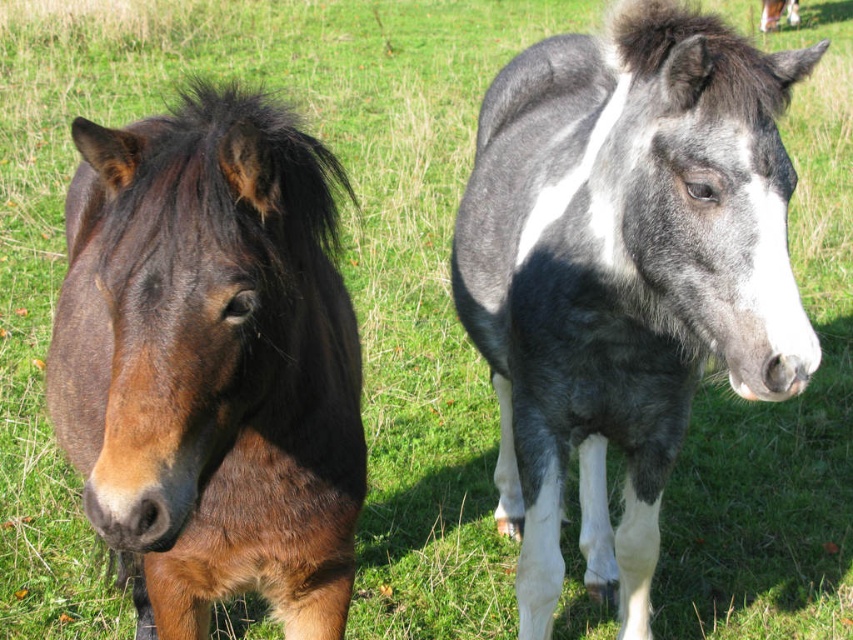
You are a photographer standing at the point marked as point (624,273) in the image. You want to take a photo of the speckled gray horse at center. Is the point you are standing at the correct location to capture the speckled gray horse at center in the frame?

Yes, the point (624,273) corresponds to the speckled gray horse at center, so standing there would allow you to capture it in the frame.

Looking at this image, you are a photographer wanting to capture both the speckled gray horse at center and the white glossy horse at upper right in a single frame. Which horse will appear larger in the photo?

The speckled gray horse at center will appear larger in the photo because it is closer to the viewer than the white glossy horse at upper right.

You are a photographer trying to capture both the speckled gray horse at center and the white glossy horse at upper right in a single frame. Based on their positions, which horse would appear closer to the bottom of the photo?

The speckled gray horse at center is located below the white glossy horse at upper right, so it would appear closer to the bottom of the photo.